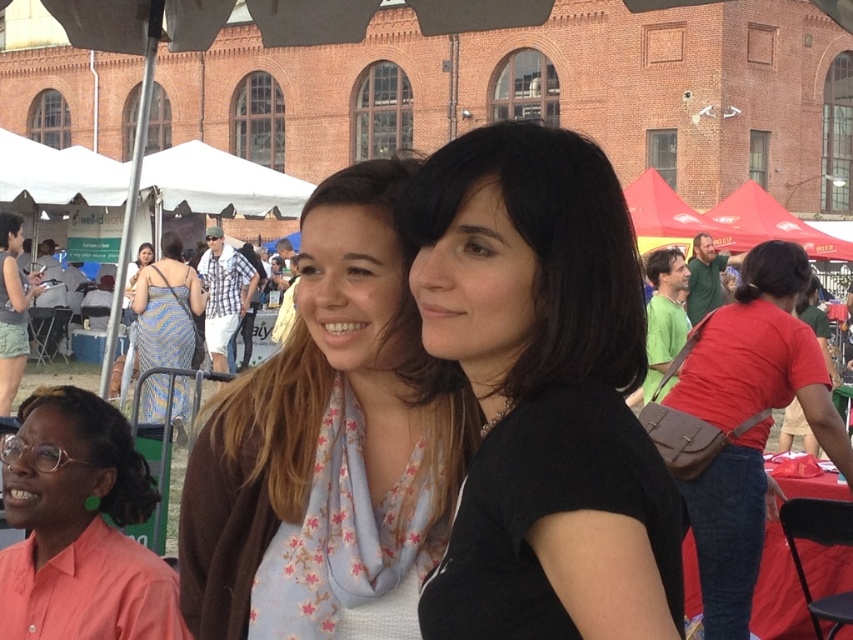
You are a photographer at the event and want to capture a photo that includes both the black matte shirt at center and the pink fabric shirt at lower left. Which shirt should you focus on first to ensure both are in the frame?

The black matte shirt at center is positioned over the pink fabric shirt at lower left, so you should focus on the black matte shirt at center first to ensure both are in the frame.

You are setting up a photo shoot and need to ensure that the black matte shirt at center and the matte black laptop at left are both visible in the frame. Given their sizes, which object will require more horizontal space in the photo to fully capture it?

The black matte shirt at center requires more horizontal space because its width is larger than the matte black laptop at left.

You are standing at the point marked as point [80,528] in the image. What object are you currently standing on?

The point [80,528] is on the pink fabric shirt at lower left.